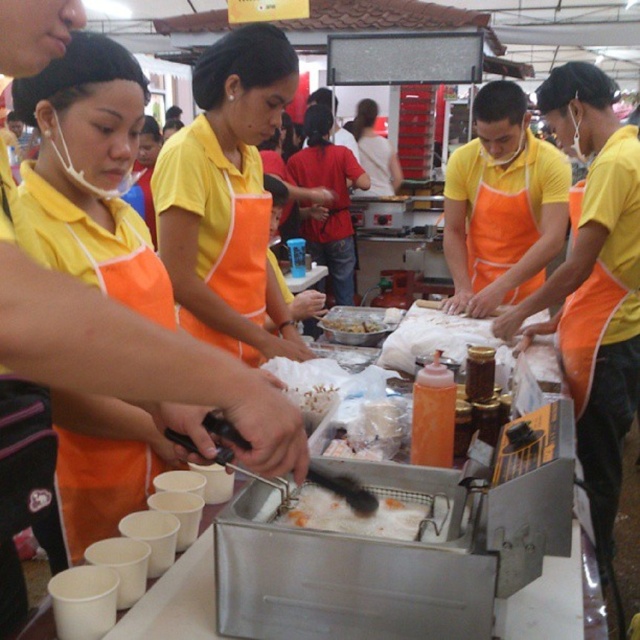
Question: Which of the following is the farthest from the observer?

Choices:
 (A) (29, 45)
 (B) (368, 166)
 (C) (380, 534)
 (D) (332, 397)

Answer: (B)

Question: Does orange apron at center appear over matte yellow shirt at center?

Choices:
 (A) no
 (B) yes

Answer: (A)

Question: Which object is positioned farthest from the fried batter at center?

Choices:
 (A) orange apron at center
 (B) matte yellow shirt at center
 (C) yellow matte fried chicken at center
 (D) white crispy snack at center

Answer: (B)

Question: Which point is closer to the camera taking this photo?

Choices:
 (A) (20, 339)
 (B) (316, 410)

Answer: (A)

Question: Does fried batter at center have a larger size compared to matte yellow shirt at center?

Choices:
 (A) yes
 (B) no

Answer: (B)

Question: Does fried batter at center appear on the right side of white crispy snack at center?

Choices:
 (A) no
 (B) yes

Answer: (B)